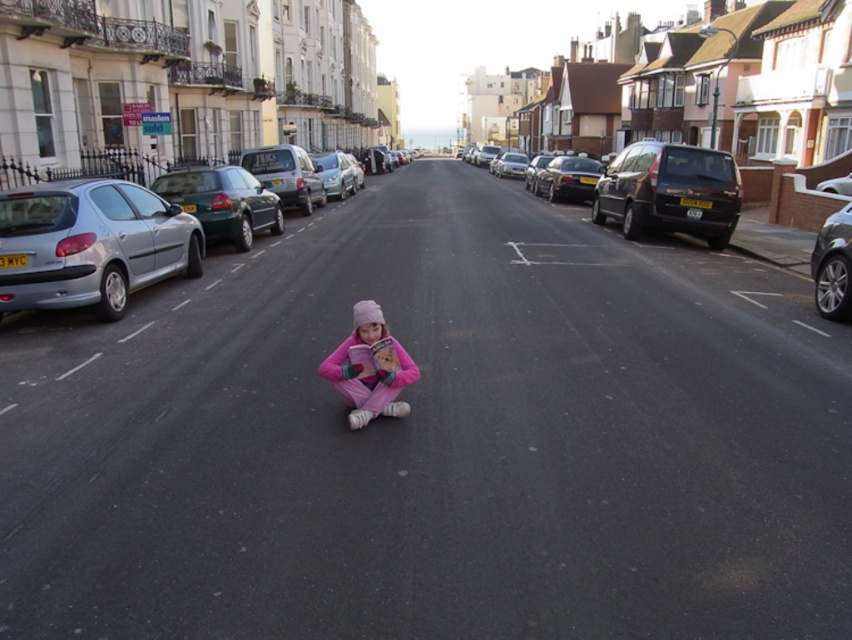
Does shiny silver car at center right come in front of shiny black car at center right?

That is True.

Does point (824, 275) lie in front of point (527, 176)?

Yes, point (824, 275) is closer to viewer.

Is point (815, 275) farther from viewer compared to point (540, 157)?

No, (815, 275) is closer to viewer.

Locate an element on the screen. The height and width of the screenshot is (640, 852). shiny silver car at center right is located at coordinates (833, 266).

Who is taller, matte silver van at center-left or shiny black car at center?

matte silver van at center-left

Is matte silver van at center-left thinner than shiny black car at center?

Correct, matte silver van at center-left's width is less than shiny black car at center's.

You are a GUI agent. You are given a task and a screenshot of the screen. Output one action in this format:
    pyautogui.click(x=<x>, y=<y>)
    Task: Click on the matte silver van at center-left
    The height and width of the screenshot is (640, 852).
    Given the screenshot: What is the action you would take?
    pyautogui.click(x=286, y=173)

The width and height of the screenshot is (852, 640). What are the coordinates of `matte silver van at center-left` in the screenshot? It's located at (286, 173).

Can you confirm if pink fleece pants at center is positioned to the left of matte silver van at center-left?

Incorrect, pink fleece pants at center is not on the left side of matte silver van at center-left.

Can you confirm if pink fleece pants at center is wider than matte silver van at center-left?

In fact, pink fleece pants at center might be narrower than matte silver van at center-left.

Where is `pink fleece pants at center`? pink fleece pants at center is located at coordinates (369, 365).